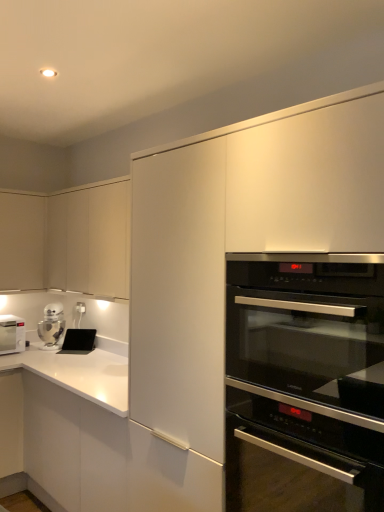
Measure the distance between point (3, 331) and camera.

10.44 feet.

What do you see at coordinates (67, 240) in the screenshot? I see `matte white cabinet at upper left, arranged as the 1th cabinetry when viewed from the right` at bounding box center [67, 240].

What do you see at coordinates (78, 341) in the screenshot? I see `black matte tablet at lower left` at bounding box center [78, 341].

Identify the location of white matte microwave at left. (11, 334).

From the image's perspective, is silver metallic robot at lower left above or below matte white cabinet at upper left, the second cabinetry in the left-to-right sequence?

silver metallic robot at lower left is situated lower than matte white cabinet at upper left, the second cabinetry in the left-to-right sequence, in the image.

How much distance is there between silver metallic robot at lower left and matte white cabinet at upper left, arranged as the 1th cabinetry when viewed from the right?

silver metallic robot at lower left and matte white cabinet at upper left, arranged as the 1th cabinetry when viewed from the right, are 68.67 centimeters apart.

Looking at their sizes, would you say silver metallic robot at lower left is wider or thinner than matte white cabinet at upper left, the second cabinetry in the left-to-right sequence?

Clearly, silver metallic robot at lower left has less width compared to matte white cabinet at upper left, the second cabinetry in the left-to-right sequence.

From the picture: Would you say silver metallic robot at lower left is outside matte white cabinet at upper left, arranged as the 1th cabinetry when viewed from the right?

Indeed, silver metallic robot at lower left is completely outside matte white cabinet at upper left, arranged as the 1th cabinetry when viewed from the right.

From the image's perspective, is matte white cabinet at upper left, arranged as the second cabinetry when viewed from the right, above matte white cabinet at upper left, the second cabinetry in the left-to-right sequence?

Correct, matte white cabinet at upper left, arranged as the second cabinetry when viewed from the right, appears higher than matte white cabinet at upper left, the second cabinetry in the left-to-right sequence, in the image.

Considering the positions of objects matte white cabinet at upper left, arranged as the second cabinetry when viewed from the right, and matte white cabinet at upper left, the second cabinetry in the left-to-right sequence, in the image provided, who is more to the left, matte white cabinet at upper left, arranged as the second cabinetry when viewed from the right, or matte white cabinet at upper left, the second cabinetry in the left-to-right sequence,?

Positioned to the left is matte white cabinet at upper left, arranged as the second cabinetry when viewed from the right.

Consider the image. Measure the distance between matte white cabinet at upper left, arranged as the second cabinetry when viewed from the right, and matte white cabinet at upper left, arranged as the 1th cabinetry when viewed from the right.

10.04 inches.

You are a GUI agent. You are given a task and a screenshot of the screen. Output one action in this format:
    pyautogui.click(x=<x>, y=<y>)
    Task: Click on the cabinetry located on the right of matte white cabinet at upper left, arranged as the second cabinetry when viewed from the right
    The image size is (384, 512).
    Given the screenshot: What is the action you would take?
    pyautogui.click(x=67, y=240)

Does matte white cabinet at upper left, arranged as the 1th cabinetry when viewed from the right, appear on the right side of silver metallic robot at lower left?

Correct, you'll find matte white cabinet at upper left, arranged as the 1th cabinetry when viewed from the right, to the right of silver metallic robot at lower left.

Is matte white cabinet at upper left, arranged as the 1th cabinetry when viewed from the right, turned away from silver metallic robot at lower left?

matte white cabinet at upper left, arranged as the 1th cabinetry when viewed from the right, is not turned away from silver metallic robot at lower left.

From a real-world perspective, is matte white cabinet at upper left, the second cabinetry in the left-to-right sequence, above or below silver metallic robot at lower left?

From a real-world perspective, matte white cabinet at upper left, the second cabinetry in the left-to-right sequence, is physically above silver metallic robot at lower left.

Which object is further away from the camera taking this photo, matte white cabinet at upper left, arranged as the 1th cabinetry when viewed from the right, or silver metallic robot at lower left?

silver metallic robot at lower left.

Is the depth of black matte tablet at lower left greater than that of white matte microwave at left?

Yes, it is.

Considering the relative positions of black matte tablet at lower left and white matte microwave at left in the image provided, is black matte tablet at lower left to the right of white matte microwave at left from the viewer's perspective?

Yes, black matte tablet at lower left is to the right of white matte microwave at left.

Looking at this image, is black matte tablet at lower left taller or shorter than white matte microwave at left?

Considering their sizes, black matte tablet at lower left has less height than white matte microwave at left.

How distant is black matte tablet at lower left from white matte microwave at left?

black matte tablet at lower left is 16.57 inches away from white matte microwave at left.

Is black matte tablet at lower left aimed at silver metallic robot at lower left?

No, black matte tablet at lower left does not turn towards silver metallic robot at lower left.

Between black matte tablet at lower left and silver metallic robot at lower left, which one has smaller width?

black matte tablet at lower left is thinner.

Does point (66, 344) appear closer or farther from the camera than point (65, 323)?

Point (66, 344).

Based on their positions, is black matte tablet at lower left located to the left or right of silver metallic robot at lower left?

black matte tablet at lower left is to the right of silver metallic robot at lower left.

How different are the orientations of white matte microwave at left and white plastic electric outlet at upper left in degrees?

There is a 88.4-degree angle between the facing directions of white matte microwave at left and white plastic electric outlet at upper left.

Is white matte microwave at left situated inside white plastic electric outlet at upper left or outside?

white matte microwave at left is not enclosed by white plastic electric outlet at upper left.

Between white matte microwave at left and white plastic electric outlet at upper left, which one has smaller size?

white plastic electric outlet at upper left.

Is white matte microwave at left to the left or to the right of white plastic electric outlet at upper left in the image?

From the image, it's evident that white matte microwave at left is to the left of white plastic electric outlet at upper left.

Is white matte microwave at left taller than matte white cabinet at upper left, positioned as the 1th cabinetry in left-to-right order?

Incorrect, the height of white matte microwave at left is not larger of that of matte white cabinet at upper left, positioned as the 1th cabinetry in left-to-right order.

How distant is white matte microwave at left from matte white cabinet at upper left, arranged as the second cabinetry when viewed from the right?

Answer: white matte microwave at left is 22.60 inches away from matte white cabinet at upper left, arranged as the second cabinetry when viewed from the right.

Can matte white cabinet at upper left, positioned as the 1th cabinetry in left-to-right order, be found inside white matte microwave at left?

No, white matte microwave at left does not contain matte white cabinet at upper left, positioned as the 1th cabinetry in left-to-right order.

Which object is wider, white matte microwave at left or matte white cabinet at upper left, arranged as the second cabinetry when viewed from the right?

Wider between the two is white matte microwave at left.

At what (x,y) coordinates should I click in order to perform the action: click on kitchen appliance below the matte white cabinet at upper left, the second cabinetry in the left-to-right sequence (from the image's perspective). Please return your answer as a coordinate pair (x, y). Looking at the image, I should click on (52, 324).

Find the location of a particular element. The height and width of the screenshot is (512, 384). cabinetry above the matte white cabinet at upper left, arranged as the 1th cabinetry when viewed from the right (from the image's perspective) is located at coordinates (22, 241).

Which object lies further to the anchor point black glass oven at center right, white matte microwave at left or silver metallic robot at lower left?

white matte microwave at left is further to black glass oven at center right.

Which object lies nearer to the anchor point silver metallic robot at lower left, white plastic electric outlet at upper left or matte white cabinet at upper left, the second cabinetry in the left-to-right sequence?

The object closer to silver metallic robot at lower left is white plastic electric outlet at upper left.

Based on their spatial positions, is white plastic electric outlet at upper left or matte white cabinet at upper left, arranged as the 1th cabinetry when viewed from the right, further from black matte tablet at lower left?

The object further to black matte tablet at lower left is matte white cabinet at upper left, arranged as the 1th cabinetry when viewed from the right.

Based on their spatial positions, is matte white cabinet at upper left, the second cabinetry in the left-to-right sequence, or matte white cabinet at upper left, positioned as the 1th cabinetry in left-to-right order, closer to white plastic electric outlet at upper left?

The object closer to white plastic electric outlet at upper left is matte white cabinet at upper left, positioned as the 1th cabinetry in left-to-right order.

Which object lies nearer to the anchor point silver metallic robot at lower left, white matte microwave at left or matte white cabinet at upper left, arranged as the 1th cabinetry when viewed from the right?

The object closer to silver metallic robot at lower left is white matte microwave at left.

Looking at the image, which one is located closer to white plastic electric outlet at upper left, silver metallic robot at lower left or white matte microwave at left?

Among the two, silver metallic robot at lower left is located nearer to white plastic electric outlet at upper left.

From the image, which object appears to be farther from matte white cabinet at upper left, positioned as the 1th cabinetry in left-to-right order, black glass oven at center right or black matte tablet at lower left?

The object further to matte white cabinet at upper left, positioned as the 1th cabinetry in left-to-right order, is black glass oven at center right.

When comparing their distances from black matte tablet at lower left, does silver metallic robot at lower left or matte white cabinet at upper left, the second cabinetry in the left-to-right sequence, seem closer?

silver metallic robot at lower left is closer to black matte tablet at lower left.

Image resolution: width=384 pixels, height=512 pixels. In order to click on kitchen appliance between black matte tablet at lower left and white plastic electric outlet at upper left along the z-axis in this screenshot , I will do `click(52, 324)`.

The width and height of the screenshot is (384, 512). I want to click on appliance between matte white cabinet at upper left, arranged as the 1th cabinetry when viewed from the right, and white plastic electric outlet at upper left from front to back, so click(x=78, y=341).

The height and width of the screenshot is (512, 384). In order to click on kitchen appliance situated between white matte microwave at left and white plastic electric outlet at upper left from left to right in this screenshot , I will do `click(52, 324)`.

The width and height of the screenshot is (384, 512). Find the location of `home appliance located between black glass oven at center right and black matte tablet at lower left in the depth direction`. home appliance located between black glass oven at center right and black matte tablet at lower left in the depth direction is located at coordinates (11, 334).